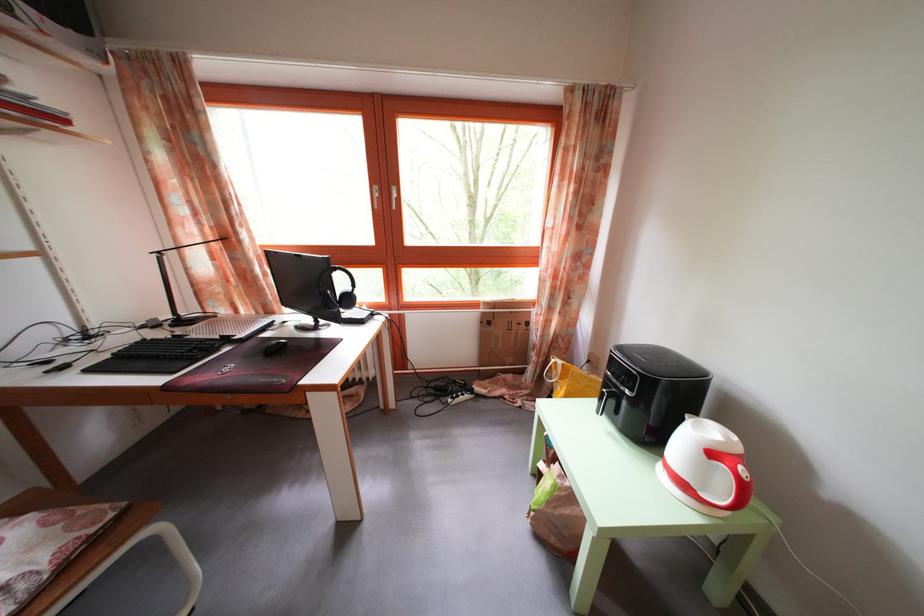
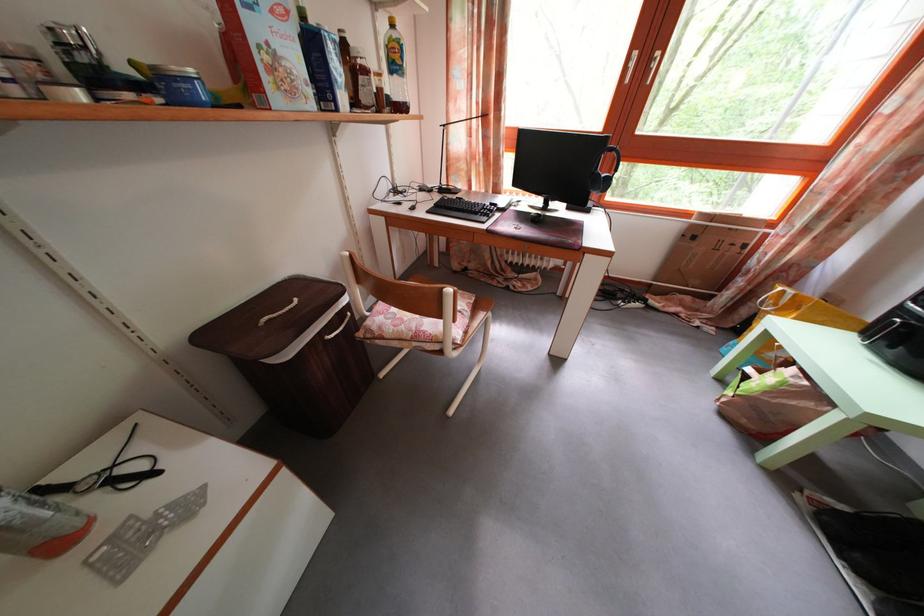
The images are taken continuously from a first-person perspective. In which direction is your viewpoint rotating?

The camera's rotation is toward left-down.